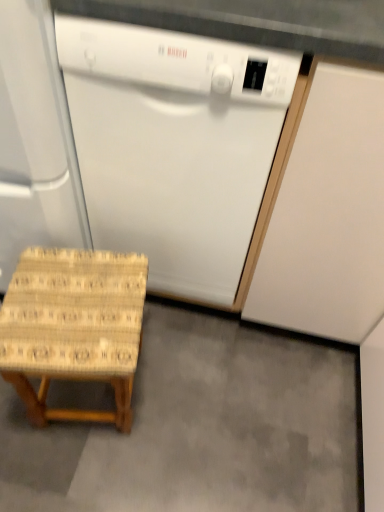
Locate an element on the screen. spots to the right of woven wood stool at lower left is located at coordinates (190, 396).